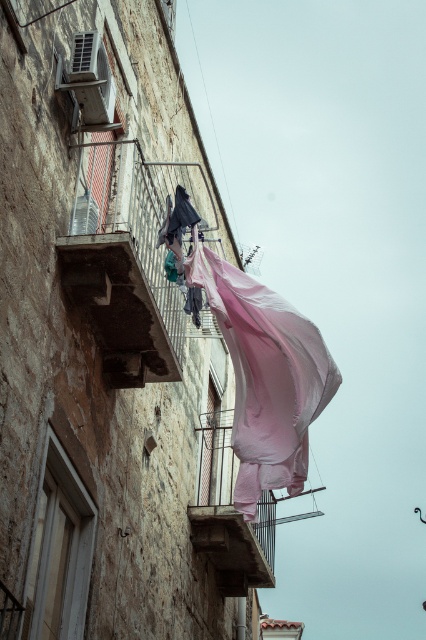
Is rusty metal balcony at center to the left of matte pink fabric at upper left from the viewer's perspective?

No, rusty metal balcony at center is not to the left of matte pink fabric at upper left.

Is rusty metal balcony at center shorter than matte pink fabric at upper left?

No.

Where is `rusty metal balcony at center`? rusty metal balcony at center is located at coordinates (126, 259).

You are a GUI agent. You are given a task and a screenshot of the screen. Output one action in this format:
    pyautogui.click(x=<x>, y=<y>)
    Task: Click on the rusty metal balcony at center
    This screenshot has width=426, height=640.
    Given the screenshot: What is the action you would take?
    pyautogui.click(x=126, y=259)

Who is more distant from viewer, (x=103, y=177) or (x=233, y=588)?

Point (x=233, y=588)

Does rusty metal balcony at center have a greater height compared to metal mesh balcony at center?

Correct, rusty metal balcony at center is much taller as metal mesh balcony at center.

The width and height of the screenshot is (426, 640). What are the coordinates of `rusty metal balcony at center` in the screenshot? It's located at (126, 259).

Does point (224, 492) lie behind point (92, 144)?

Yes.

Who is positioned more to the right, metal mesh balcony at center or matte pink fabric at upper left?

From the viewer's perspective, metal mesh balcony at center appears more on the right side.

What do you see at coordinates (230, 515) in the screenshot? I see `metal mesh balcony at center` at bounding box center [230, 515].

This screenshot has width=426, height=640. Find the location of `metal mesh balcony at center`. metal mesh balcony at center is located at coordinates (230, 515).